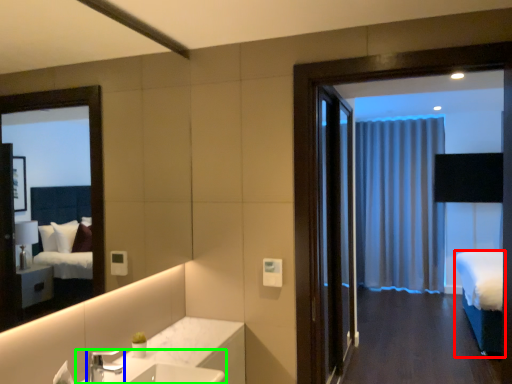
Question: Considering the real-world distances, which object is closest to bed (highlighted by a red box)? tap (highlighted by a blue box) or sink (highlighted by a green box).

Choices:
 (A) tap
 (B) sink

Answer: (B)